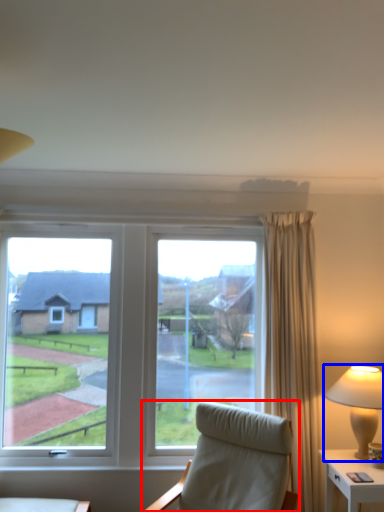
Question: Which point is closer to the camera, chair (highlighted by a red box) or lamp (highlighted by a blue box)?

Choices:
 (A) chair
 (B) lamp

Answer: (A)